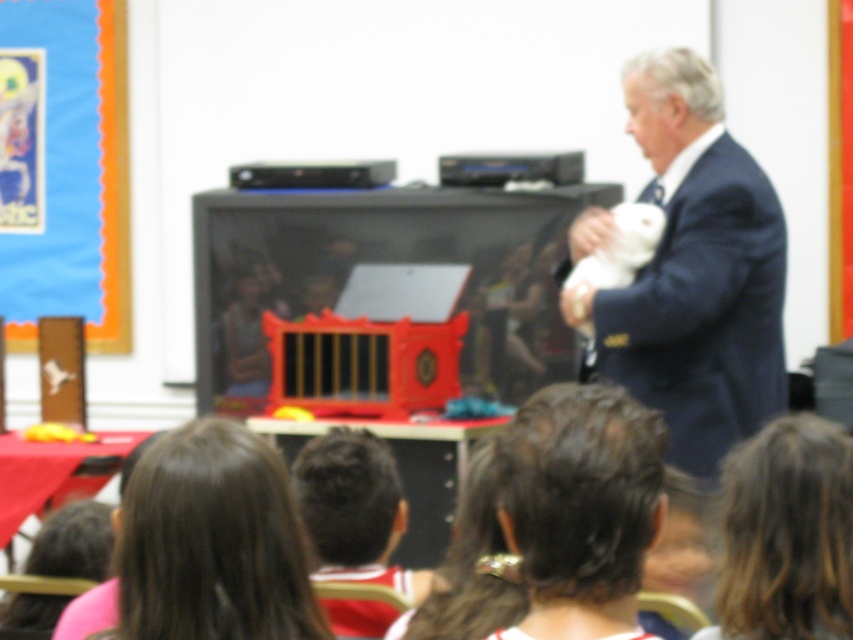
Question: Does dark brown hair at center have a larger size compared to brown hair at lower right?

Choices:
 (A) no
 (B) yes

Answer: (B)

Question: Which point is farther to the camera?

Choices:
 (A) dark brown hair at center
 (B) dark blue suit at right
 (C) brown hair at lower left

Answer: (B)

Question: Which of the following is the farthest from the observer?

Choices:
 (A) dark brown hair at center
 (B) dark blue suit at right

Answer: (B)

Question: Is dark brown hair at center above brown hair at lower right?

Choices:
 (A) yes
 (B) no

Answer: (B)

Question: Which of these objects is positioned farthest from the brown hair at lower left?

Choices:
 (A) dark brown hair at center
 (B) dark blue suit at right
 (C) brown hair at lower right

Answer: (B)

Question: Is dark brown hair at center in front of brown hair at lower left?

Choices:
 (A) yes
 (B) no

Answer: (A)